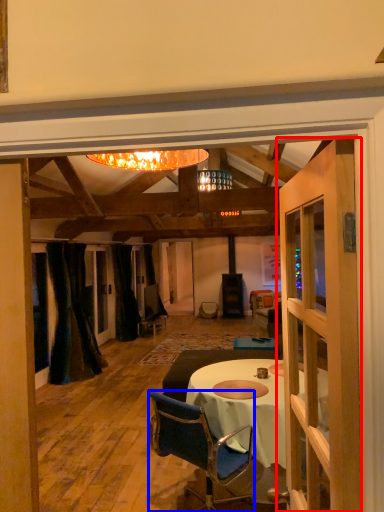
Question: Which point is closer to the camera, door (highlighted by a red box) or chair (highlighted by a blue box)?

Choices:
 (A) door
 (B) chair

Answer: (A)